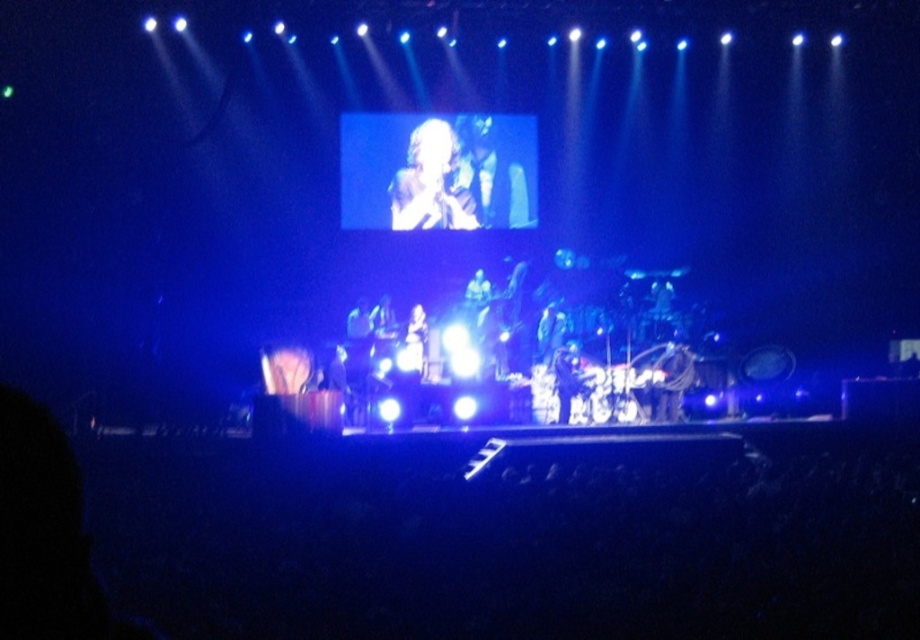
You are a photographer at the concert and want to capture a clear shot of the blonde hair at center without the shiny black guitar at center blocking it. How should you adjust your position?

The blonde hair at center is behind the shiny black guitar at center. To capture a clear shot of the blonde hair at center without the guitar blocking it, you should move your camera position to the side so that you can see around the shiny black guitar at center.